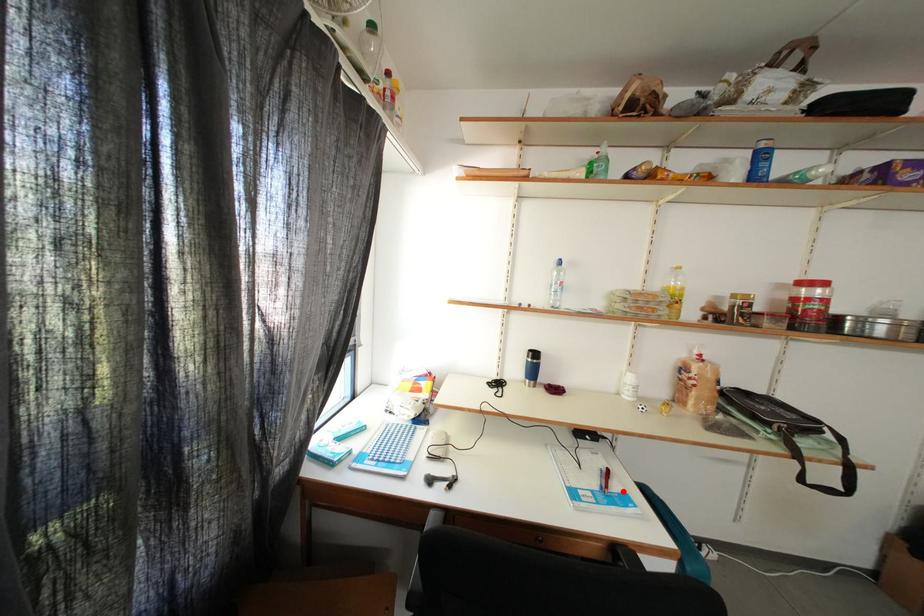
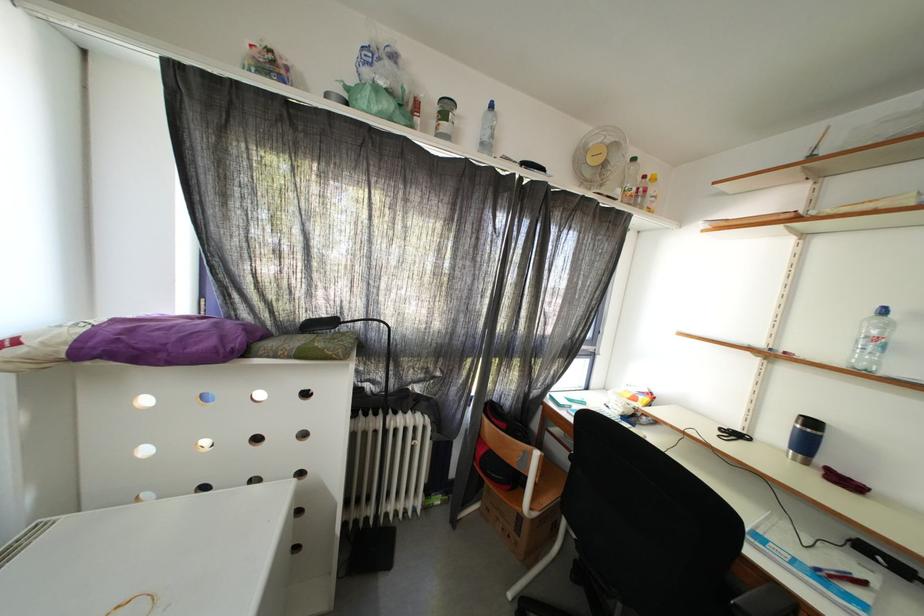
Where in the second image is the point corresponding to the highlighted location from the first image?

(864, 597)